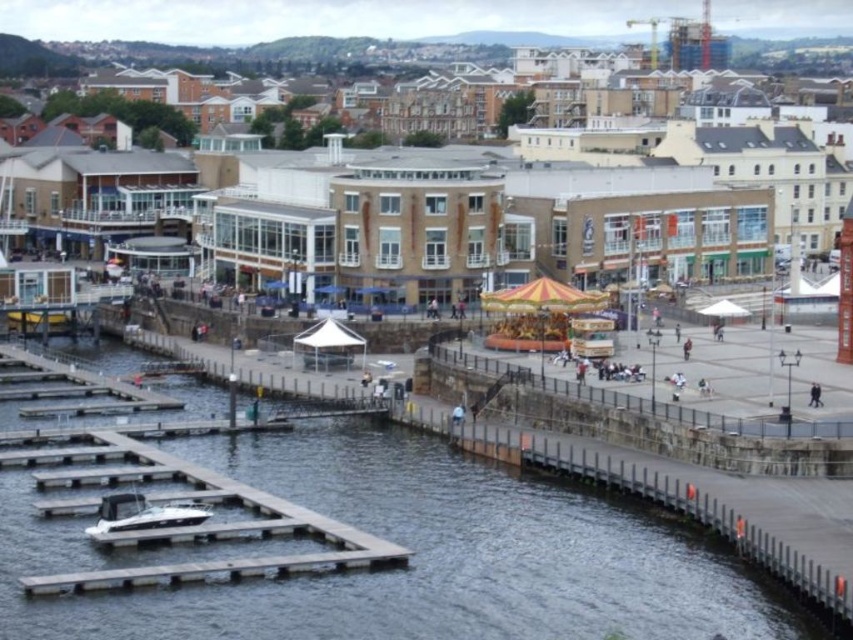
Who is more distant from viewer, (280, 598) or (247, 536)?

The point (247, 536) is more distant.

Is clear water at lower left to the right of white matte dock at lower left from the viewer's perspective?

In fact, clear water at lower left is to the left of white matte dock at lower left.

Where is `clear water at lower left`? Image resolution: width=853 pixels, height=640 pixels. clear water at lower left is located at coordinates (410, 560).

Where is `clear water at lower left`? Image resolution: width=853 pixels, height=640 pixels. clear water at lower left is located at coordinates (410, 560).

Between clear water at lower left and white glossy boat at lower left, which one is positioned lower?

Positioned lower is white glossy boat at lower left.

Based on the photo, who is positioned more to the left, clear water at lower left or white glossy boat at lower left?

Positioned to the left is clear water at lower left.

Where is `clear water at lower left`? clear water at lower left is located at coordinates (410, 560).

Does white matte dock at lower left have a greater height compared to white glossy boat at lower left?

Indeed, white matte dock at lower left has a greater height compared to white glossy boat at lower left.

Who is more forward, (4, 461) or (99, 518)?

Point (99, 518) is in front.

At what (x,y) coordinates should I click in order to perform the action: click on white matte dock at lower left. Please return your answer as a coordinate pair (x, y). This screenshot has width=853, height=640. Looking at the image, I should click on pyautogui.click(x=183, y=525).